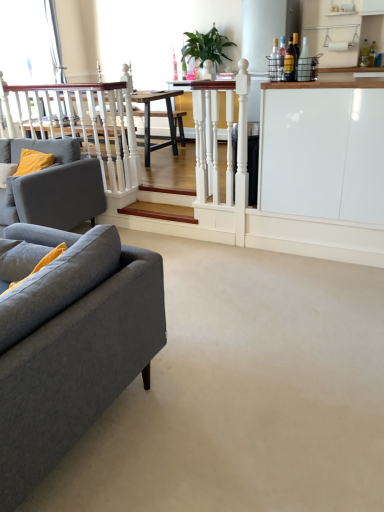
Question: Considering the relative positions of green leafy plant at upper center and white glossy cabinet at right in the image provided, is green leafy plant at upper center to the right of white glossy cabinet at right from the viewer's perspective?

Choices:
 (A) no
 (B) yes

Answer: (A)

Question: Is green leafy plant at upper center oriented away from white glossy cabinet at right?

Choices:
 (A) yes
 (B) no

Answer: (B)

Question: Is green leafy plant at upper center completely or partially outside of white glossy cabinet at right?

Choices:
 (A) yes
 (B) no

Answer: (A)

Question: Is green leafy plant at upper center aimed at white glossy cabinet at right?

Choices:
 (A) no
 (B) yes

Answer: (A)

Question: From the image's perspective, would you say green leafy plant at upper center is positioned over white glossy cabinet at right?

Choices:
 (A) yes
 (B) no

Answer: (A)

Question: Does green leafy plant at upper center have a lesser height compared to white glossy cabinet at right?

Choices:
 (A) yes
 (B) no

Answer: (A)

Question: Considering the relative sizes of white glossy cabinet at right and gray fabric couch at left, which is counted as the 1th studio couch, starting from the front, in the image provided, is white glossy cabinet at right bigger than gray fabric couch at left, which is counted as the 1th studio couch, starting from the front,?

Choices:
 (A) yes
 (B) no

Answer: (B)

Question: From the image's perspective, would you say white glossy cabinet at right is shown under gray fabric couch at left, the 2th studio couch from the back?

Choices:
 (A) no
 (B) yes

Answer: (A)

Question: Considering the relative sizes of white glossy cabinet at right and gray fabric couch at left, which is counted as the 1th studio couch, starting from the front, in the image provided, is white glossy cabinet at right thinner than gray fabric couch at left, which is counted as the 1th studio couch, starting from the front,?

Choices:
 (A) yes
 (B) no

Answer: (A)

Question: Is white glossy cabinet at right to the right of gray fabric couch at left, the 2th studio couch from the back, from the viewer's perspective?

Choices:
 (A) no
 (B) yes

Answer: (B)

Question: Considering the relative sizes of white glossy cabinet at right and gray fabric couch at left, which is counted as the 1th studio couch, starting from the front, in the image provided, is white glossy cabinet at right smaller than gray fabric couch at left, which is counted as the 1th studio couch, starting from the front,?

Choices:
 (A) no
 (B) yes

Answer: (B)

Question: Considering the relative sizes of white glossy cabinet at right and gray fabric couch at left, which is counted as the 1th studio couch, starting from the front, in the image provided, is white glossy cabinet at right taller than gray fabric couch at left, which is counted as the 1th studio couch, starting from the front,?

Choices:
 (A) yes
 (B) no

Answer: (A)

Question: Is matte gray fabric couch at left, which ranks as the first studio couch in back-to-front order, surrounding wooden stairs at center?

Choices:
 (A) yes
 (B) no

Answer: (B)